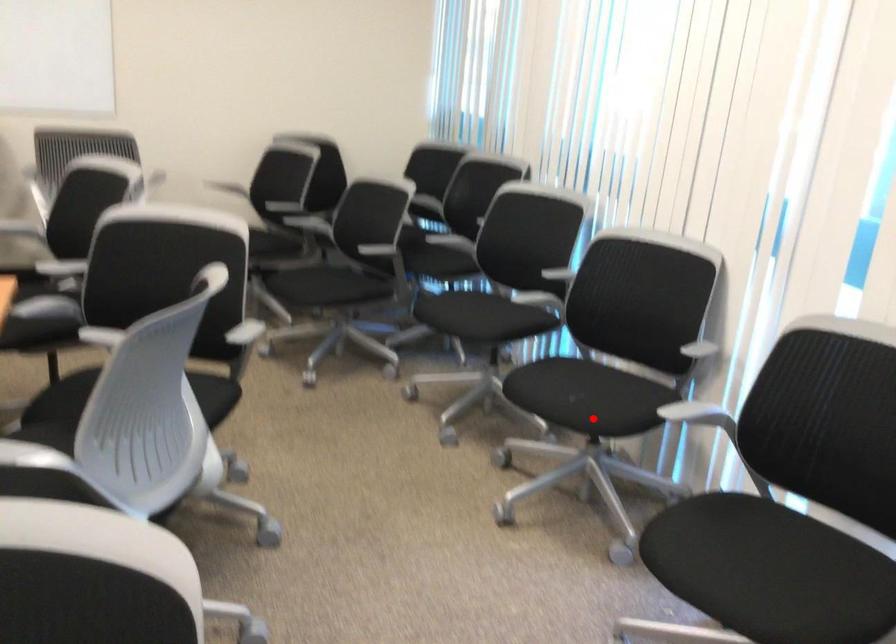
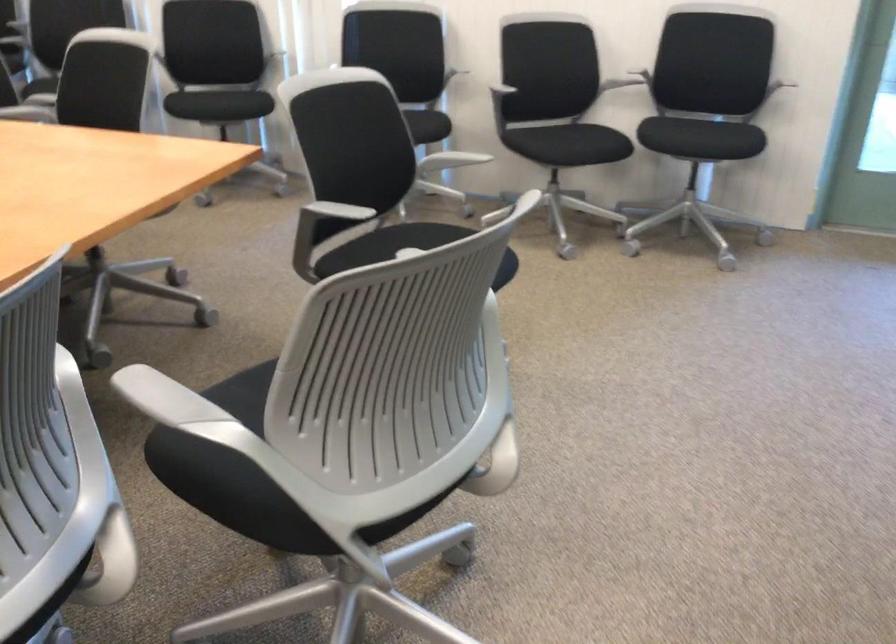
Question: I am providing you with two images of the same scene from different viewpoints. In image1, a red point is highlighted. Considering the same 3D point in image2, which of the following is correct?

Choices:
 (A) It is closer
 (B) It is farther

Answer: (B)